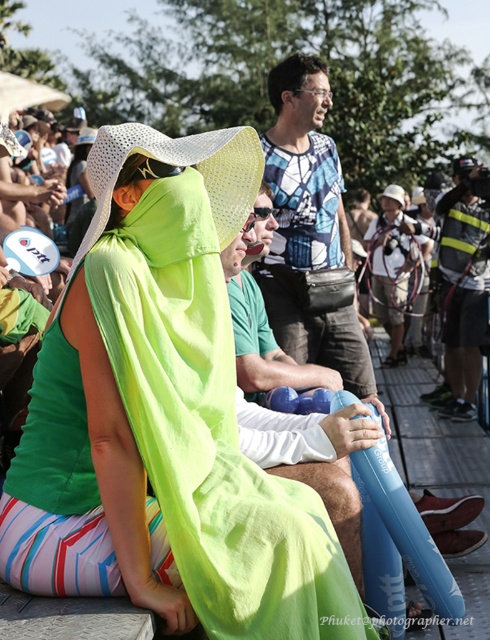
Is point (196, 529) farther from viewer compared to point (291, 170)?

No, it is in front of (291, 170).

Is point (244, 545) farther from viewer compared to point (310, 218)?

No.

Locate an element on the screen. neon green towel at center is located at coordinates (173, 406).